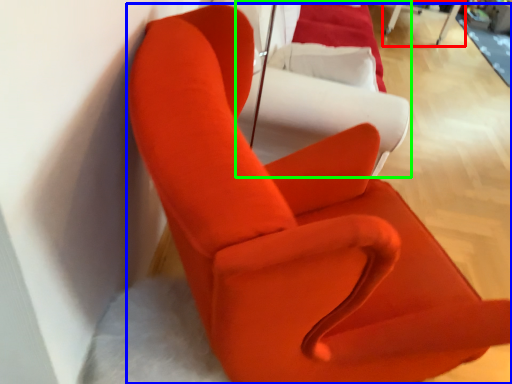
Question: Based on their relative distances, which object is nearer to table (highlighted by a red box)? Choose from chair (highlighted by a blue box) and couch (highlighted by a green box).

Choices:
 (A) chair
 (B) couch

Answer: (B)